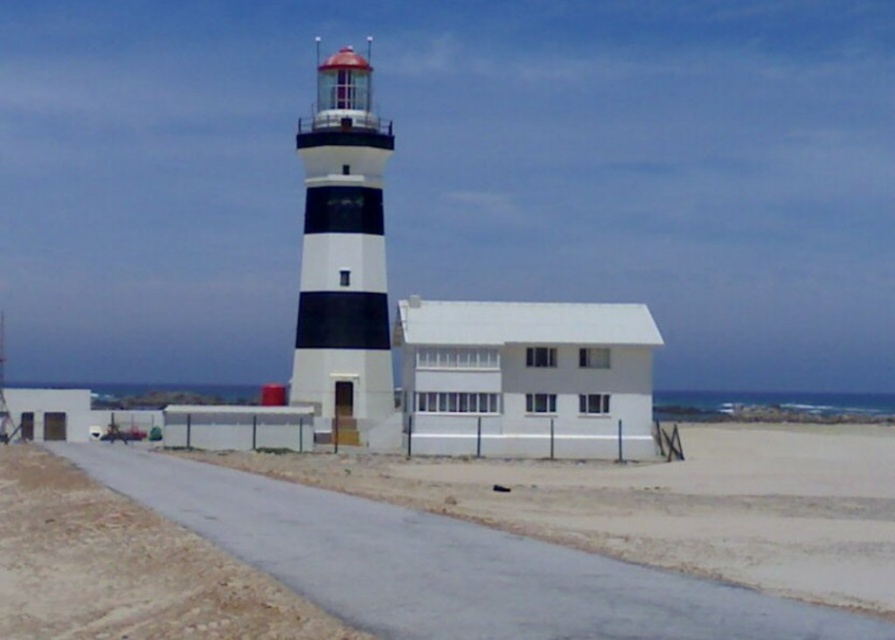
Question: Considering the relative positions of sandy beach at lower center and brown gravel at lower center in the image provided, where is sandy beach at lower center located with respect to brown gravel at lower center?

Choices:
 (A) right
 (B) left

Answer: (A)

Question: Which of the following is the closest to the observer?

Choices:
 (A) (705, 588)
 (B) (56, 592)
 (C) (334, 148)

Answer: (A)

Question: Which of the following is the farthest from the observer?

Choices:
 (A) brown gravel at lower center
 (B) sandy beach at lower center

Answer: (A)

Question: Observing the image, what is the correct spatial positioning of brown gravel at lower center in reference to black and white striped lighthouse at center?

Choices:
 (A) left
 (B) right

Answer: (B)

Question: Does sandy beach at lower center have a smaller size compared to brown gravel at lower center?

Choices:
 (A) no
 (B) yes

Answer: (B)

Question: Which object is positioned farthest from the black and white striped lighthouse at center?

Choices:
 (A) sandy beach at lower center
 (B) brown gravel at lower center

Answer: (A)